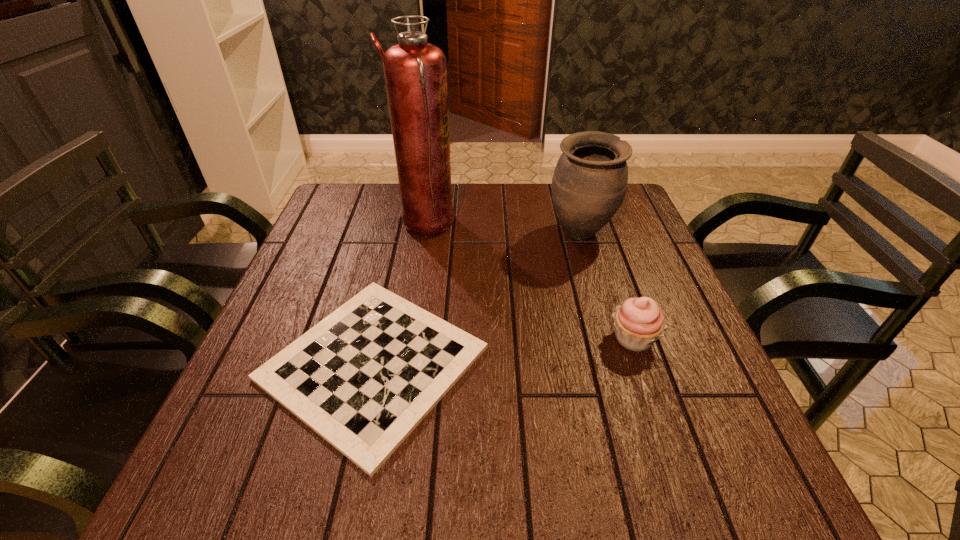
This screenshot has width=960, height=540. Identify the location of fire extinguisher. (415, 71).

Find the location of a particular element. The height and width of the screenshot is (540, 960). the third shortest object is located at coordinates (589, 183).

Find the location of a particular element. Image resolution: width=960 pixels, height=540 pixels. cupcake is located at coordinates (639, 322).

In order to click on the shortest object in this screenshot , I will do `click(363, 378)`.

Where is `blank space located 0.260m on the side of the fire extinguisher with the label`? The width and height of the screenshot is (960, 540). blank space located 0.260m on the side of the fire extinguisher with the label is located at coordinates (546, 225).

Find the location of a particular element. The width and height of the screenshot is (960, 540). free region located 0.090m on the right of the second tallest object is located at coordinates (646, 234).

I want to click on vacant space located 0.350m on the back of the cupcake, so click(595, 229).

What are the coordinates of `free space located 0.190m on the back of the shortest object` in the screenshot? It's located at (401, 239).

Identify the location of fire extinguisher located in the far edge section of the desktop. This screenshot has height=540, width=960. (415, 71).

Where is `urn at the far edge`? The width and height of the screenshot is (960, 540). urn at the far edge is located at coordinates (589, 183).